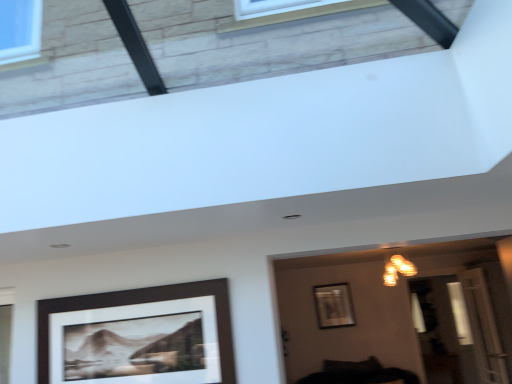
Question: Should I look upward or downward to see metallic silver picture frame at center, the first picture frame from the right?

Choices:
 (A) down
 (B) up

Answer: (A)

Question: Does metallic silver picture frame at center, the first picture frame from the right, have a greater width compared to black matte picture frame at lower left, the 1th picture frame positioned from the top?

Choices:
 (A) yes
 (B) no

Answer: (A)

Question: From a real-world perspective, is metallic silver picture frame at center, the second picture frame positioned from the left, on black matte picture frame at lower left, marked as the 2th picture frame in a right-to-left arrangement?

Choices:
 (A) no
 (B) yes

Answer: (B)

Question: Does metallic silver picture frame at center, the second picture frame positioned from the left, turn towards black matte picture frame at lower left, placed as the second picture frame when sorted from bottom to top?

Choices:
 (A) yes
 (B) no

Answer: (A)

Question: Is metallic silver picture frame at center, placed as the second picture frame when sorted from top to bottom, not near black matte picture frame at lower left, placed as the first picture frame when sorted from left to right?

Choices:
 (A) no
 (B) yes

Answer: (B)

Question: Can you confirm if metallic silver picture frame at center, placed as the second picture frame when sorted from top to bottom, is positioned to the right of black matte picture frame at lower left, the 1th picture frame positioned from the top?

Choices:
 (A) yes
 (B) no

Answer: (A)

Question: Is metallic silver picture frame at center, which appears as the 2th picture frame when viewed from the front, bigger than black matte picture frame at lower left, marked as the 2th picture frame in a right-to-left arrangement?

Choices:
 (A) no
 (B) yes

Answer: (A)

Question: Can we say warm matte light fixture at upper center lies outside black matte picture frame at lower left, the 2th picture frame from the back?

Choices:
 (A) yes
 (B) no

Answer: (A)

Question: Can you confirm if warm matte light fixture at upper center is positioned to the right of black matte picture frame at lower left, the 2th picture frame from the back?

Choices:
 (A) yes
 (B) no

Answer: (A)

Question: Is warm matte light fixture at upper center further to the viewer compared to black matte picture frame at lower left, placed as the first picture frame when sorted from left to right?

Choices:
 (A) yes
 (B) no

Answer: (A)

Question: Would you say warm matte light fixture at upper center contains black matte picture frame at lower left, the 2th picture frame from the back?

Choices:
 (A) no
 (B) yes

Answer: (A)

Question: Considering the relative sizes of warm matte light fixture at upper center and black matte picture frame at lower left, marked as the 2th picture frame in a right-to-left arrangement, in the image provided, is warm matte light fixture at upper center wider than black matte picture frame at lower left, marked as the 2th picture frame in a right-to-left arrangement,?

Choices:
 (A) no
 (B) yes

Answer: (B)

Question: From the image's perspective, is warm matte light fixture at upper center over black matte picture frame at lower left, the 1th picture frame positioned from the top?

Choices:
 (A) no
 (B) yes

Answer: (B)

Question: Considering the relative positions of warm matte light fixture at upper center and metallic silver picture frame at center, the second picture frame positioned from the left, in the image provided, is warm matte light fixture at upper center to the right of metallic silver picture frame at center, the second picture frame positioned from the left, from the viewer's perspective?

Choices:
 (A) yes
 (B) no

Answer: (A)